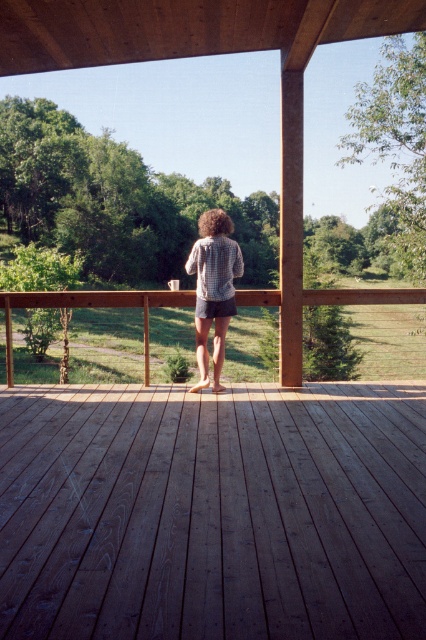
Question: Which of these objects is positioned farthest from the brown wooden deck at center?

Choices:
 (A) wooden porch at center
 (B) plaid shirt at center

Answer: (A)

Question: Which point is farther from the camera taking this photo?

Choices:
 (A) (219, 276)
 (B) (131, 292)
 (C) (302, 445)
 (D) (213, 308)

Answer: (B)

Question: From the image, what is the correct spatial relationship of plaid shirt at center in relation to denim shorts at center?

Choices:
 (A) below
 (B) above

Answer: (B)

Question: Does wooden porch at center have a greater width compared to plaid shirt at center?

Choices:
 (A) yes
 (B) no

Answer: (A)

Question: Is brown wooden deck at center further to the viewer compared to plaid shirt at center?

Choices:
 (A) yes
 (B) no

Answer: (B)

Question: Which object is farther from the camera taking this photo?

Choices:
 (A) denim shorts at center
 (B) brown wooden deck at center
 (C) plaid shirt at center
 (D) wooden porch at center

Answer: (D)